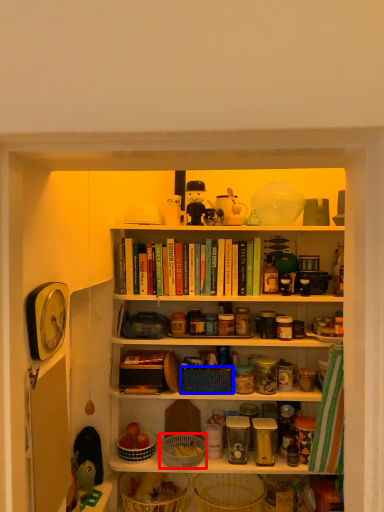
Question: Among these objects, which one is farthest to the camera, basket (highlighted by a red box) or basket (highlighted by a blue box)?

Choices:
 (A) basket
 (B) basket

Answer: (B)